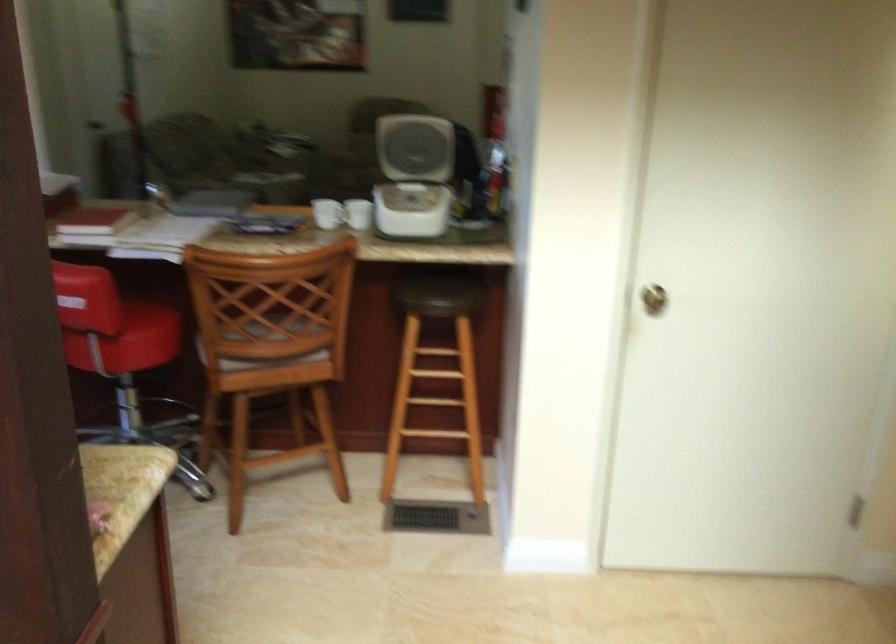
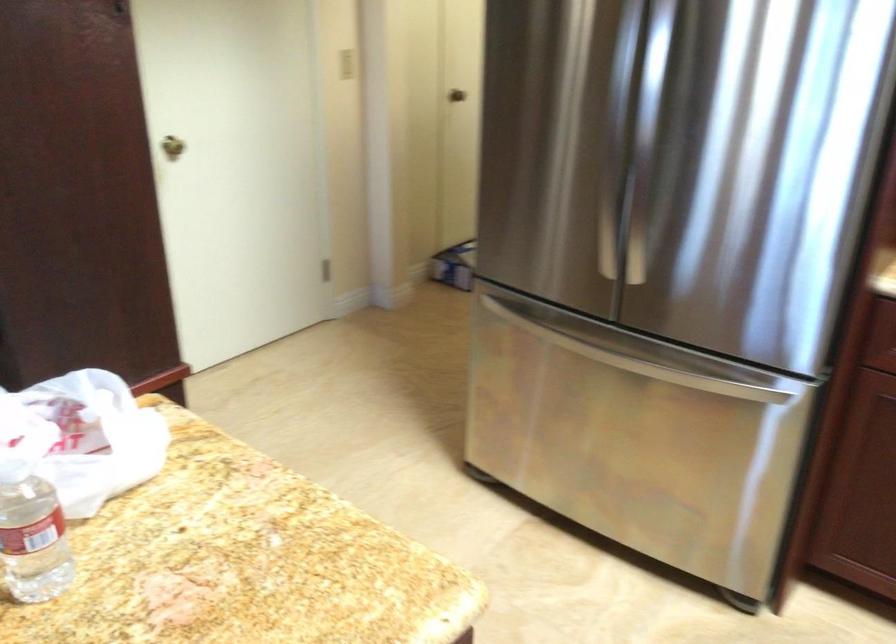
Locate, in the second image, the point that corresponds to (633,290) in the first image.

(171, 146)